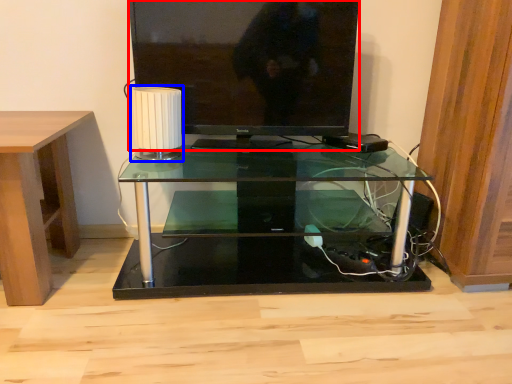
Question: Which object is closer to the camera taking this photo, television (highlighted by a red box) or lamp (highlighted by a blue box)?

Choices:
 (A) television
 (B) lamp

Answer: (B)